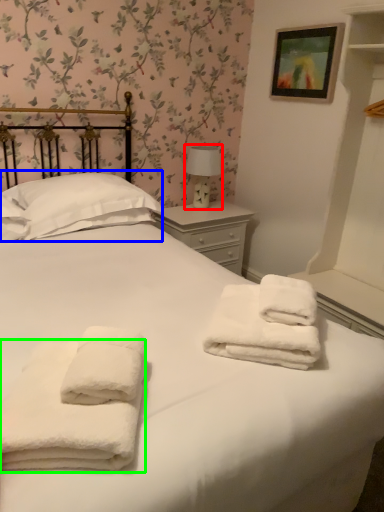
Question: Which object is positioned farthest from table lamp (highlighted by a red box)? Select from pillow (highlighted by a blue box) and towel (highlighted by a green box).

Choices:
 (A) pillow
 (B) towel

Answer: (B)